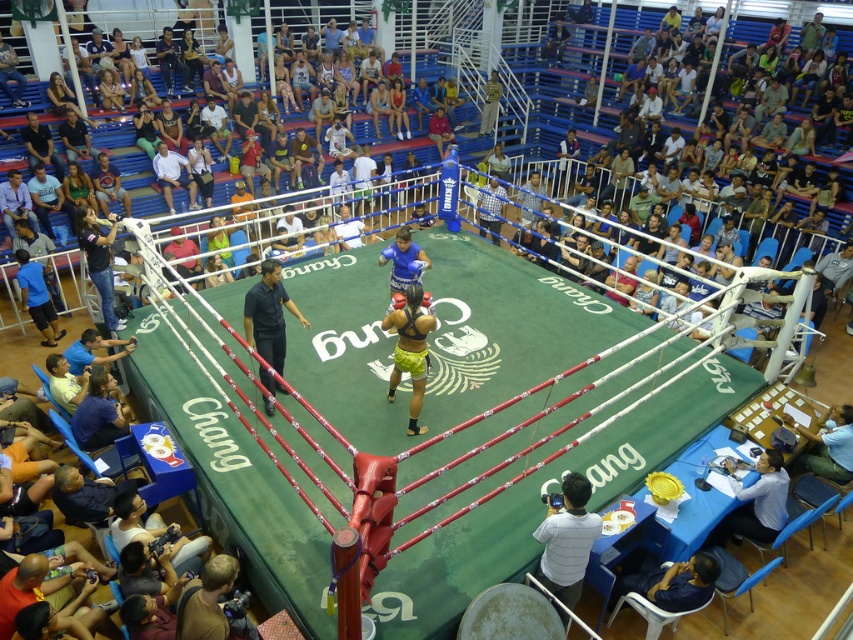
You are a photographer standing at the edge of the Muay Thai ring. You want to take a photo of the black smooth shirt at center and the referee in dark clothing. How far apart are these two subjects in meters?

The black smooth shirt at center and the referee in dark clothing are 5.82 meters apart.

You are a photographer in the arena and want to capture a photo of both the yellow fabric shorts at center and the blue leather gloves at center. Which object should you focus on first if you want to include both in your shot without moving the camera?

You should focus on the blue leather gloves at center first since the yellow fabric shorts at center is to the right of it, allowing both to be captured in the frame by centering on the gloves and including the shorts to the right.

You are a photographer standing near the white cotton camera at lower center and want to take a photo of the white cotton shirt at upper left. Can you reach the shirt within 10 meters to adjust the focus manually? Please explain.

The distance between the white cotton camera at lower center and the white cotton shirt at upper left is 9.41 meters. Since 9.41 meters is less than 10 meters, you can reach the shirt within 10 meters to adjust the focus manually.